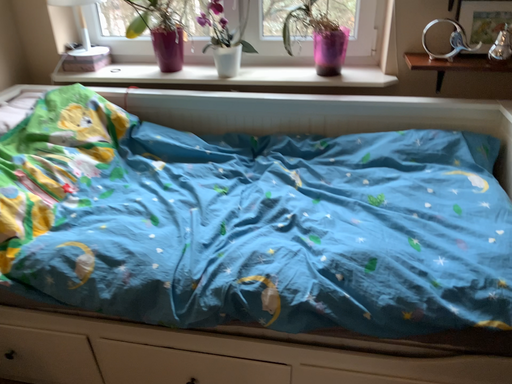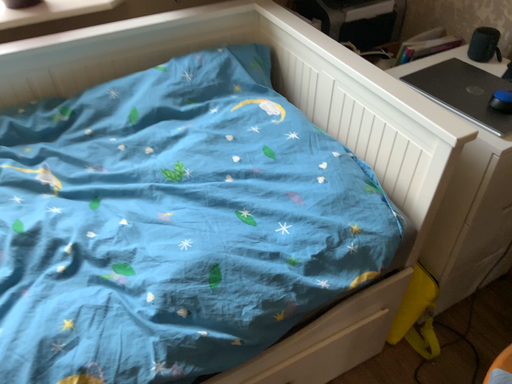
Question: How did the camera likely rotate when shooting the video?

Choices:
 (A) rotated left
 (B) rotated right

Answer: (B)